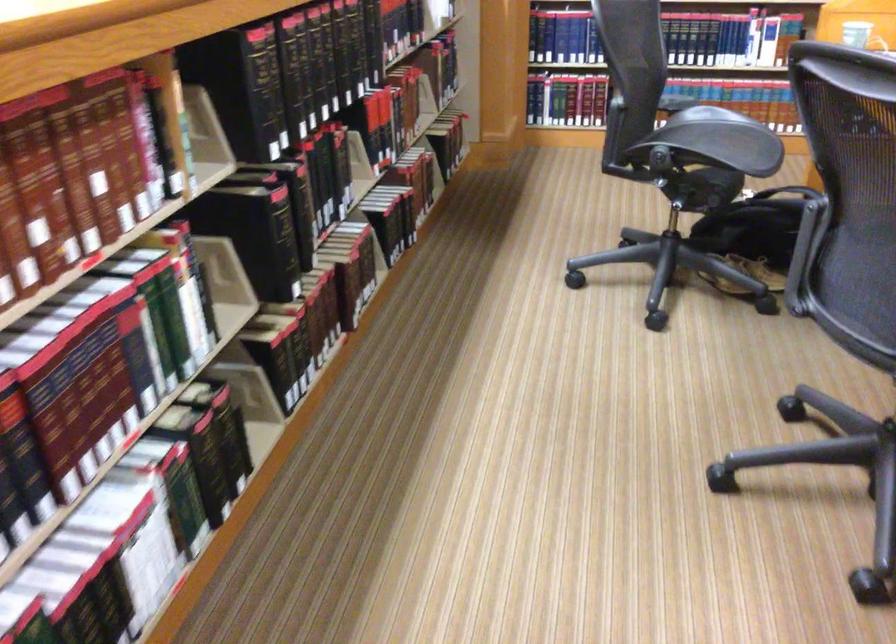
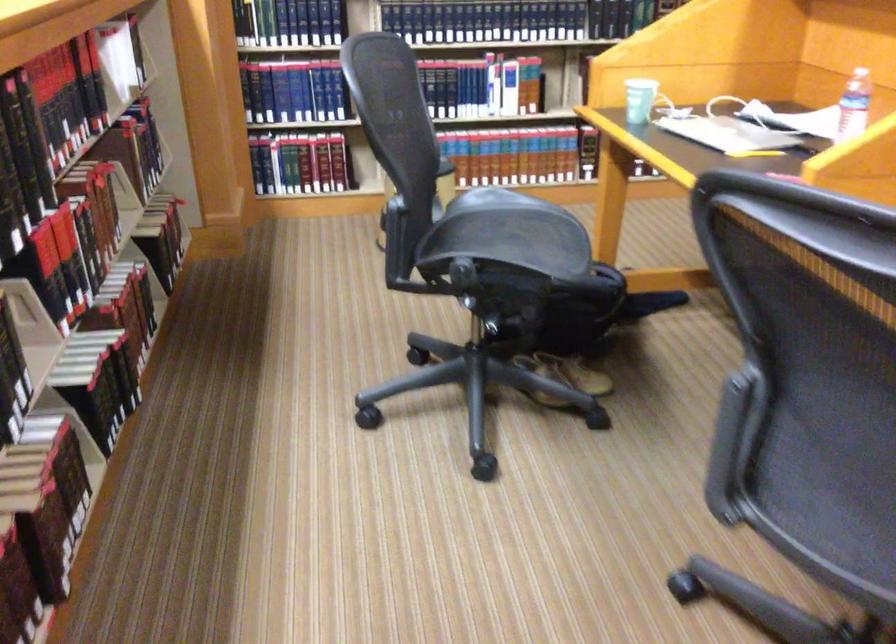
Locate, in the second image, the point that corresponds to (x=711, y=128) in the first image.

(500, 221)